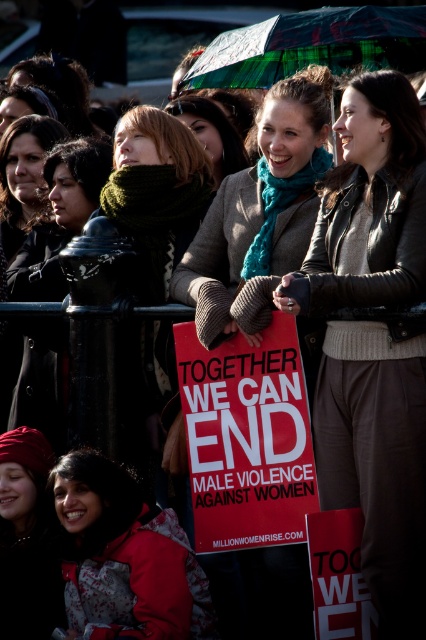
Question: Which of the following is the closest to the observer?

Choices:
 (A) red matte placard at center
 (B) matte black coat at left
 (C) green plaid umbrella at upper center
 (D) leather jacket at center

Answer: (D)

Question: Observing the image, what is the correct spatial positioning of red jacket at lower left in reference to matte black coat at left?

Choices:
 (A) above
 (B) below

Answer: (B)

Question: Is red matte placard at center to the left of red jacket at lower left from the viewer's perspective?

Choices:
 (A) yes
 (B) no

Answer: (B)

Question: Among these objects, which one is farthest from the camera?

Choices:
 (A) red jacket at lower left
 (B) leather jacket at center

Answer: (B)

Question: Which point is farther to the camera?

Choices:
 (A) matte black coat at left
 (B) red jacket at lower left
 (C) leather jacket at center

Answer: (A)

Question: Is red matte placard at center to the right of green plaid umbrella at upper center from the viewer's perspective?

Choices:
 (A) yes
 (B) no

Answer: (B)